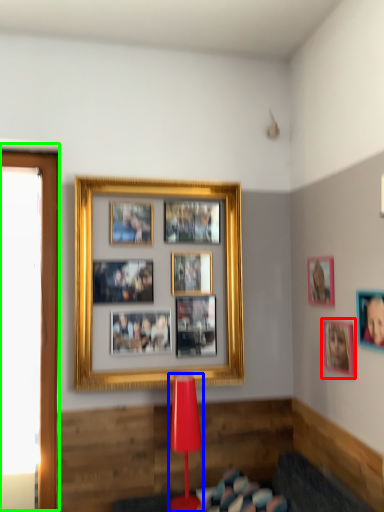
Question: Considering the real-world distances, which object is closest to picture frame (highlighted by a red box)? table lamp (highlighted by a blue box) or window screen (highlighted by a green box).

Choices:
 (A) table lamp
 (B) window screen

Answer: (A)